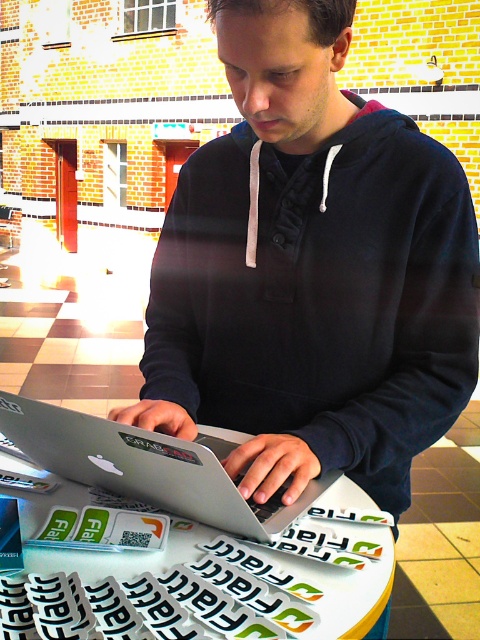
You are a delivery robot navigating a room. You need to place a package on the white glossy table at center. What coordinates should you move to?

The white glossy table at center is located at coordinates point (188, 568), so you should move to those coordinates to place the package.

You are a delivery person who needs to place a large package on the table. The package is the size of the black cotton sweatshirt at center. Is there enough space on the white glossy table at center to place it without overlapping any stickers?

The black cotton sweatshirt at center is bigger than the white glossy table at center. Therefore, placing a package of its size on the white glossy table at center would not be possible without overlapping the stickers since the package is larger than the table itself.

You are a delivery robot with a package that is 3 inches wide. You need to place it on the table without moving the laptop. Is there enough space between the white glossy table at center and the silver metallic laptop at center to place your package?

The white glossy table at center is 2.64 inches from the silver metallic laptop at center. Since the package is 3 inches wide, which is wider than the available space, there isn not enough space to place the package between them without moving the laptop.